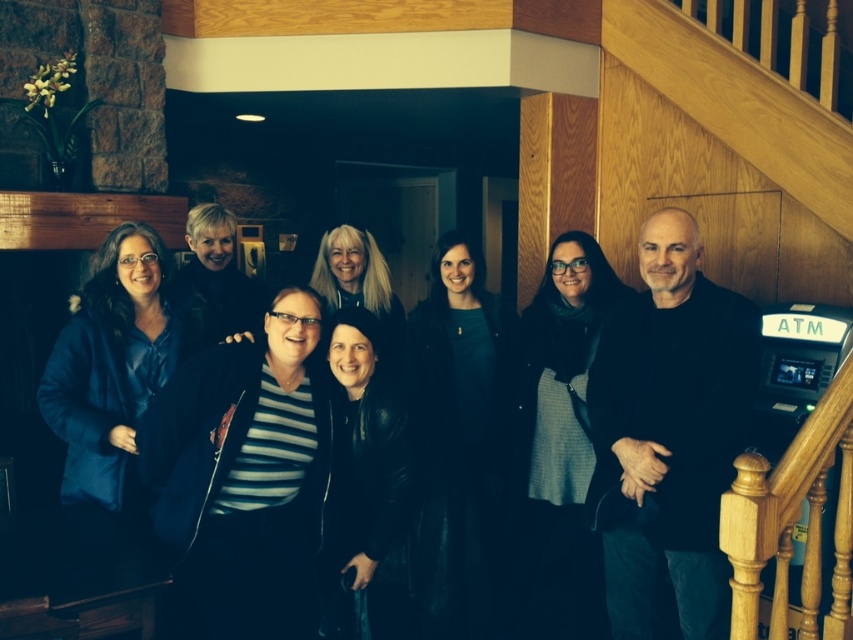
Question: Where is dark blue leather jacket at center located in relation to dark gray wool skirt at center in the image?

Choices:
 (A) above
 (B) below

Answer: (A)

Question: Which point is farther from the camera taking this photo?

Choices:
 (A) (561, 356)
 (B) (361, 605)
 (C) (543, 396)
 (D) (231, 348)

Answer: (C)

Question: Where is striped fabric shirt at center located in relation to dark gray wool skirt at center in the image?

Choices:
 (A) below
 (B) above

Answer: (B)

Question: Can you confirm if dark blue jacket at center is wider than matte blue jacket at left?

Choices:
 (A) yes
 (B) no

Answer: (A)

Question: Among these points, which one is nearest to the camera?

Choices:
 (A) (467, 310)
 (B) (310, 632)
 (C) (96, 493)

Answer: (B)

Question: Estimate the real-world distances between objects in this image. Which object is farther from the dark blue jacket at center?

Choices:
 (A) striped fabric shirt at center
 (B) matte blue jacket at left

Answer: (B)